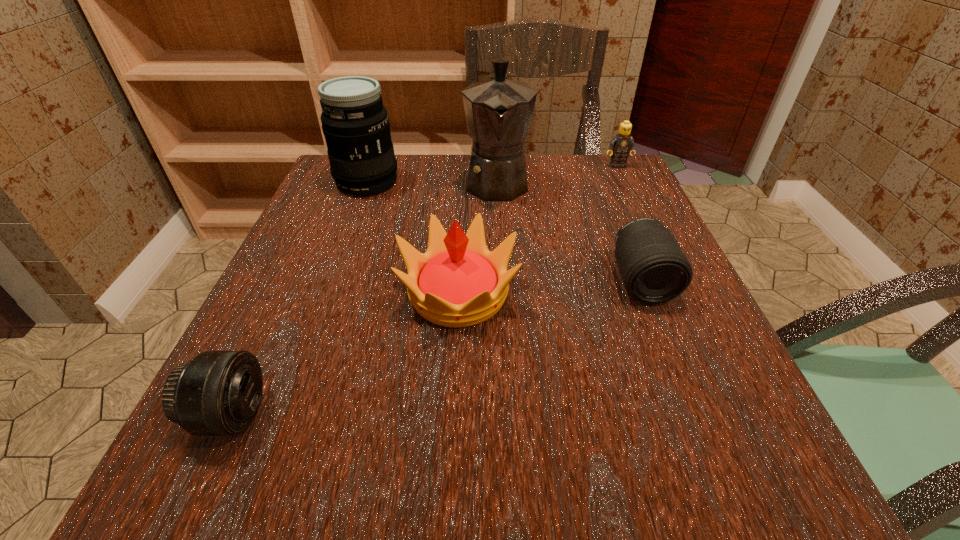
The height and width of the screenshot is (540, 960). I want to click on unoccupied area between the Lego and the fourth shortest object, so click(538, 230).

Find the location of a particular element. The image size is (960, 540). vacant space in between the second nearest telephoto lens and the tallest object is located at coordinates (569, 231).

At what (x,y) coordinates should I click in order to perform the action: click on vacant space that is in between the nearest object and the crown. Please return your answer as a coordinate pair (x, y). Looking at the image, I should click on (345, 354).

Where is `empty location between the farthest telephoto lens and the nearest telephoto lens`? The width and height of the screenshot is (960, 540). empty location between the farthest telephoto lens and the nearest telephoto lens is located at coordinates (300, 298).

Identify the location of free space between the farthest telephoto lens and the nearest object. This screenshot has width=960, height=540. (300, 298).

Find the location of `vacant area that lies between the farthest telephoto lens and the third tallest object`. vacant area that lies between the farthest telephoto lens and the third tallest object is located at coordinates (413, 237).

Identify the location of object that ranks as the closest to the crown. (498, 111).

Choose which object is the second nearest neighbor to the farthest telephoto lens. Please provide its 2D coordinates. Your answer should be formatted as a tuple, i.e. [(x, y)], where the tuple contains the x and y coordinates of a point satisfying the conditions above.

[(457, 282)]

Where is `telephoto lens that is the third closest one to the Lego`? Image resolution: width=960 pixels, height=540 pixels. telephoto lens that is the third closest one to the Lego is located at coordinates (216, 393).

Locate which telephoto lens ranks third in proximity to the Lego. Please provide its 2D coordinates. Your answer should be formatted as a tuple, i.e. [(x, y)], where the tuple contains the x and y coordinates of a point satisfying the conditions above.

[(216, 393)]